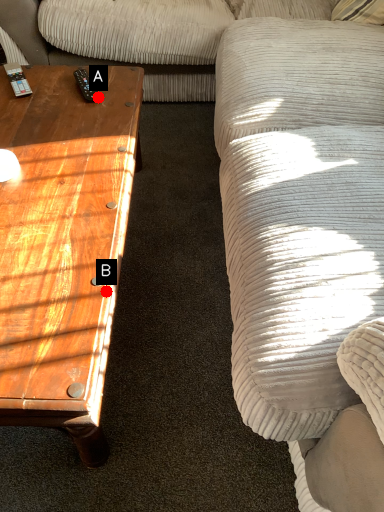
Question: Two points are circled on the image, labeled by A and B beside each circle. Which point is closer to the camera?

Choices:
 (A) A is closer
 (B) B is closer

Answer: (B)